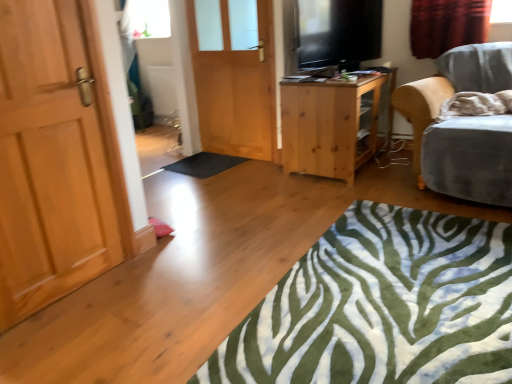
Where is `free location in front of light brown wooden door at left, the second door positioned from the back`? Image resolution: width=512 pixels, height=384 pixels. free location in front of light brown wooden door at left, the second door positioned from the back is located at coordinates [x=71, y=336].